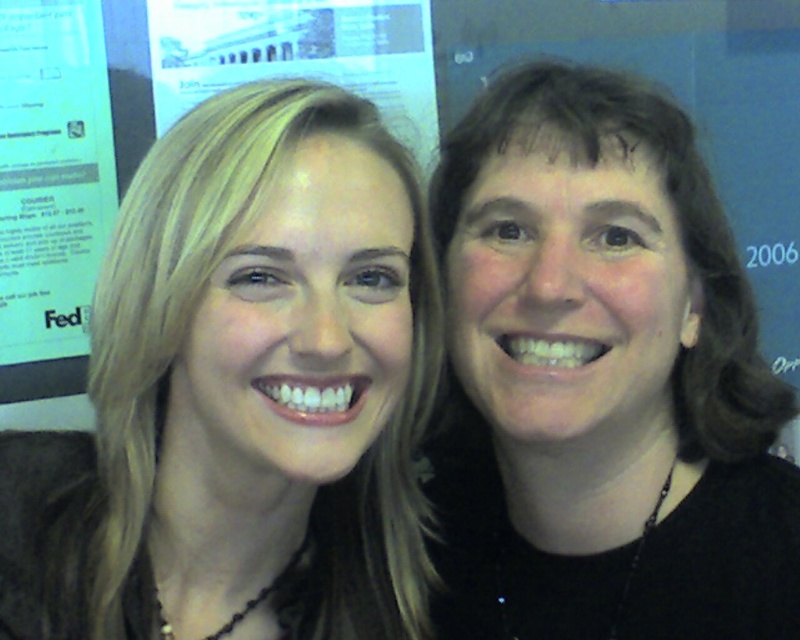
You are a photographer trying to capture a clear shot of the point at coordinates (370, 499) in the image. Given that the distance between the point and the camera is 29.67 inches, can you estimate how far you should position your camera to ensure the subject is in focus?

To capture the point at coordinates (370, 499) clearly, position your camera at a distance of approximately 29.67 inches from the point since that is the measured distance between them.

In the scene shown: You are a photographer trying to capture a group photo of the two people in the scene. Since you want to ensure the blonde hair at left and the black matte shirt at right are both visible in the frame, which direction should you adjust the camera? Explain your reasoning based on their positions.

The blonde hair at left is positioned on the left side of the black matte shirt at right. To ensure both are visible, you should adjust the camera to the right to include the left side where the blonde hair is located and the right side where the black matte shirt is positioned.

You are a photographer adjusting the camera settings for a group photo. You need to ensure that both the blonde hair at left and the black matte shirt at right are in focus. Considering their widths, which object should you adjust the focus on first to ensure proper framing?

The blonde hair at left has a greater width than the black matte shirt at right. To ensure proper framing, you should first adjust the focus on the blonde hair at left since it occupies more space in the frame.